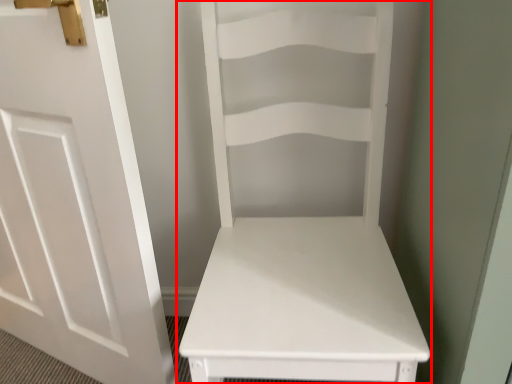
Question: Considering the relative positions of furniture (annotated by the red box) and door in the image provided, where is furniture (annotated by the red box) located with respect to the staircase?

Choices:
 (A) left
 (B) right

Answer: (B)